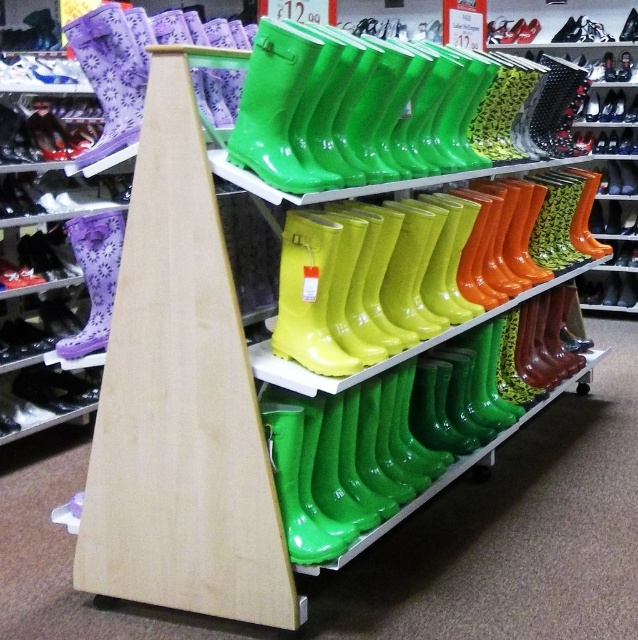
Looking at this image, you are a customer looking to purchase a pair of boots. You see the glossy rubber boots at center and the matte black shoe at lower left in the store. Which one is placed higher on the shelf?

The glossy rubber boots at center is placed higher on the shelf than the matte black shoe at lower left because it is above it.

You are a customer in a shoe store looking at the retail display. You want to pick up the matte black shoe at lower left. Is the glossy rubber boots at center blocking your access to it?

The glossy rubber boots at center is in front of the matte black shoe at lower left, so it is blocking access to the matte black shoe at lower left. You will need to move the glossy rubber boots at center to reach the matte black shoe at lower left.

You are a customer looking to buy a pair of shoes. You see the glossy rubber boots at center and the matte black shoe at lower left. Which one is taller?

The glossy rubber boots at center is much taller than the matte black shoe at lower left.